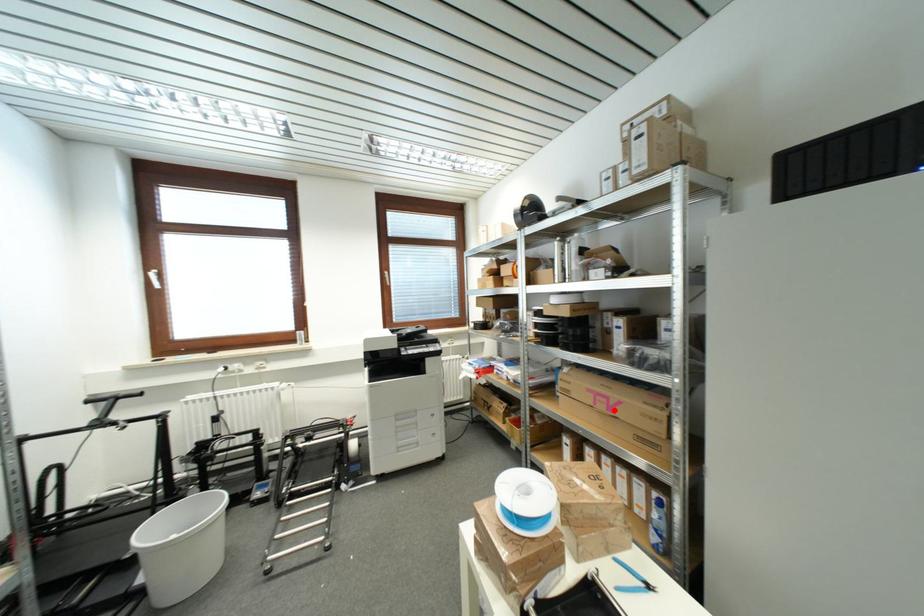
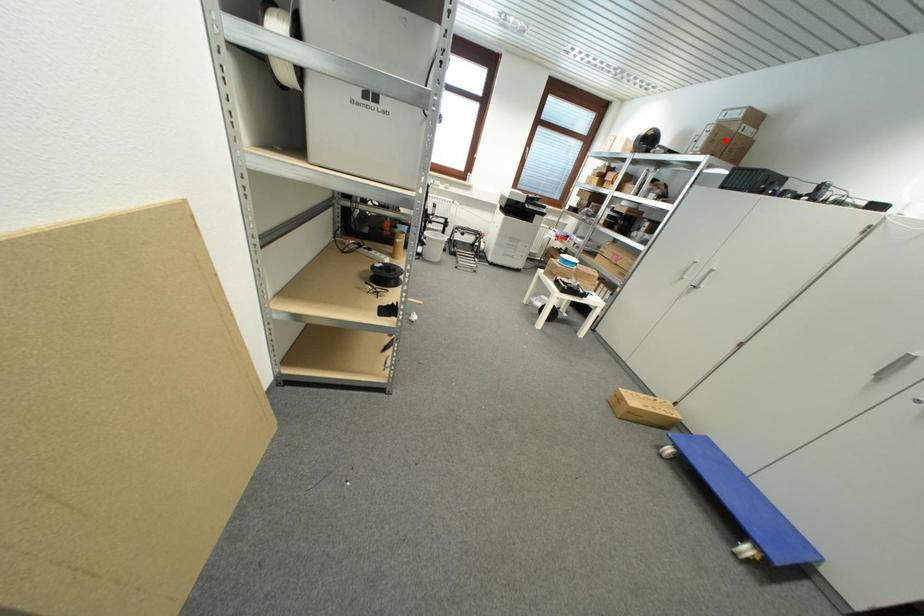
I am providing you with two images of the same scene from different viewpoints. A red point is marked on the first image and another point is marked on the second image. Do the highlighted points in image1 and image2 indicate the same real-world spot?

No